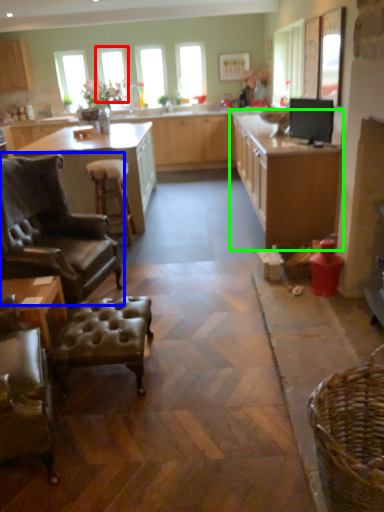
Question: Estimate the real-world distances between objects in this image. Which object is farther from window screen (highlighted by a red box), chair (highlighted by a blue box) or cabinetry (highlighted by a green box)?

Choices:
 (A) chair
 (B) cabinetry

Answer: (A)